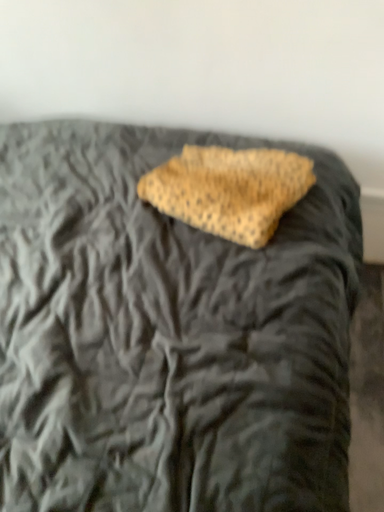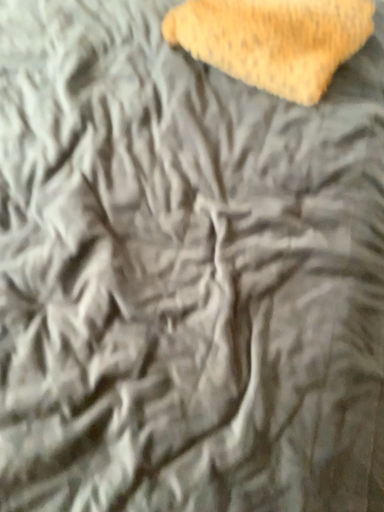
Question: How did the camera likely rotate when shooting the video?

Choices:
 (A) rotated upward
 (B) rotated downward

Answer: (B)